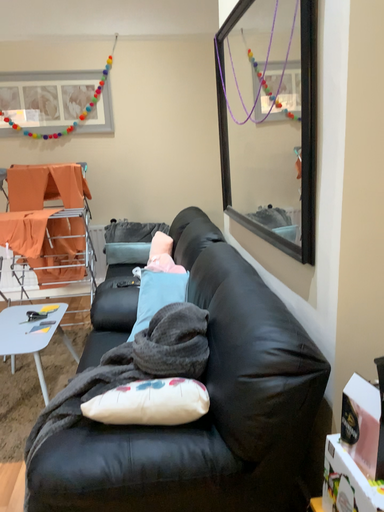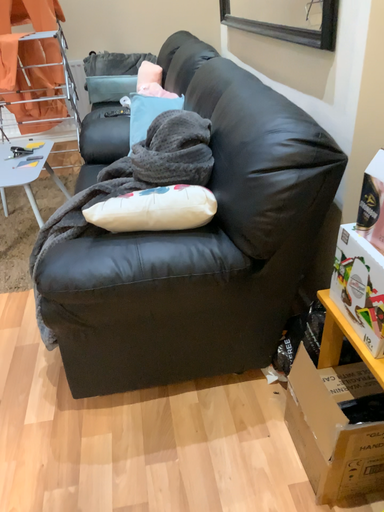
Question: Which way did the camera rotate in the video?

Choices:
 (A) rotated downward
 (B) rotated upward

Answer: (A)